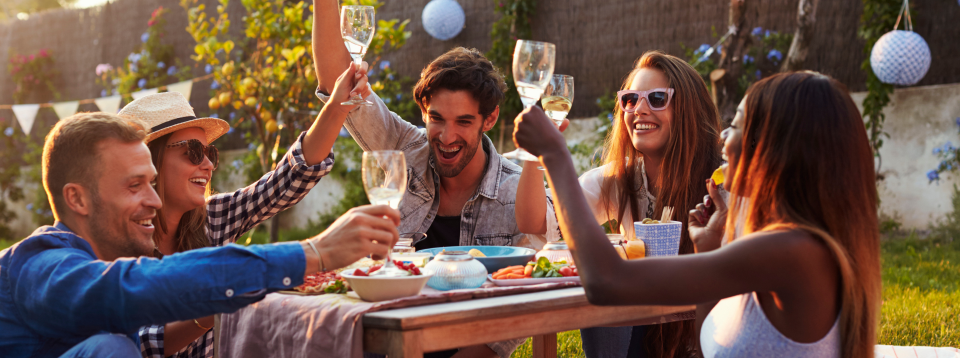
The image size is (960, 358). In order to click on drinking glasses in this screenshot , I will do `click(351, 31)`, `click(381, 175)`, `click(529, 79)`, `click(556, 95)`.